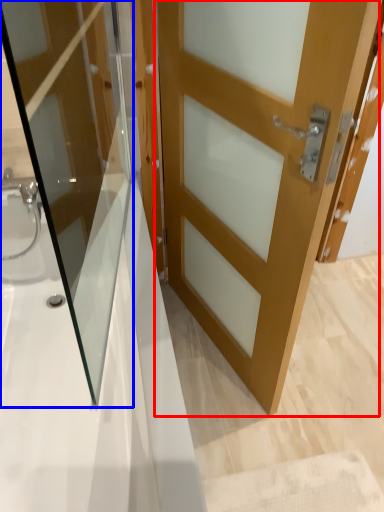
Question: Which object appears farthest to the camera in this image, door (highlighted by a red box) or door (highlighted by a blue box)?

Choices:
 (A) door
 (B) door

Answer: (A)